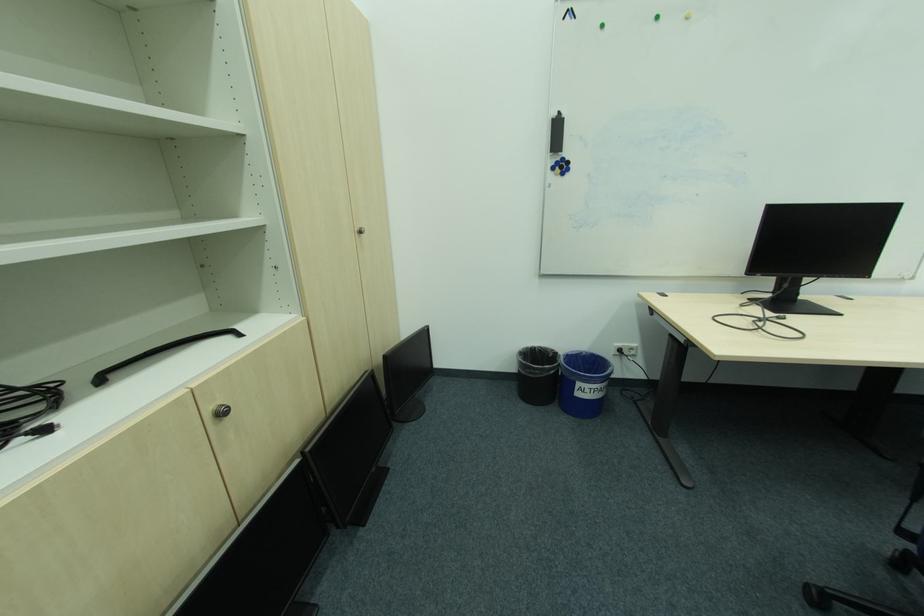
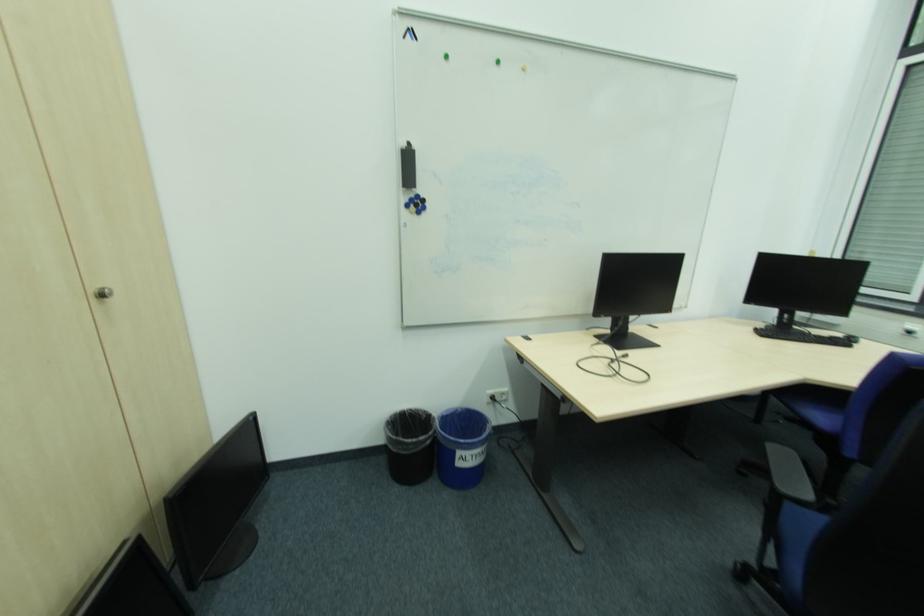
Question: The images are taken continuously from a first-person perspective. In which direction are you moving?

Choices:
 (A) Left
 (B) Right
 (C) Forward
 (D) Backward

Answer: (C)